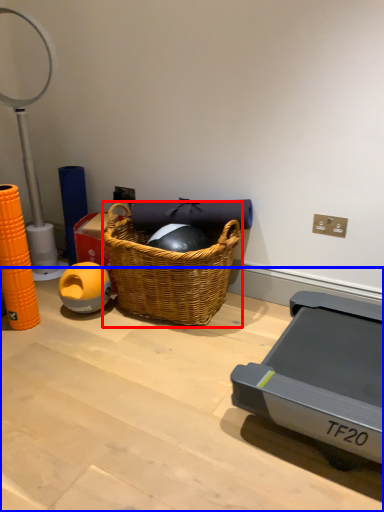
Question: Which object is closer to the camera taking this photo, picnic basket (highlighted by a red box) or table (highlighted by a blue box)?

Choices:
 (A) picnic basket
 (B) table

Answer: (B)